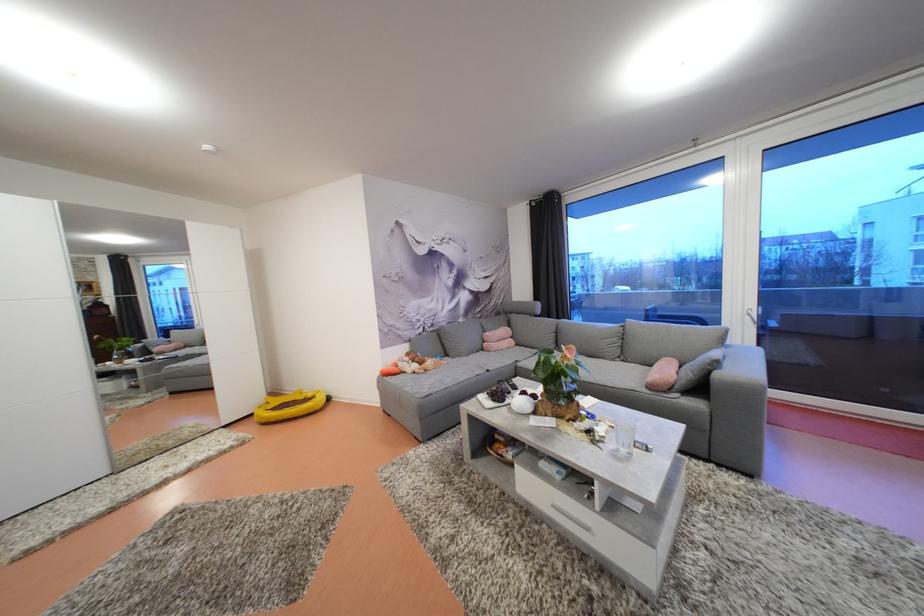
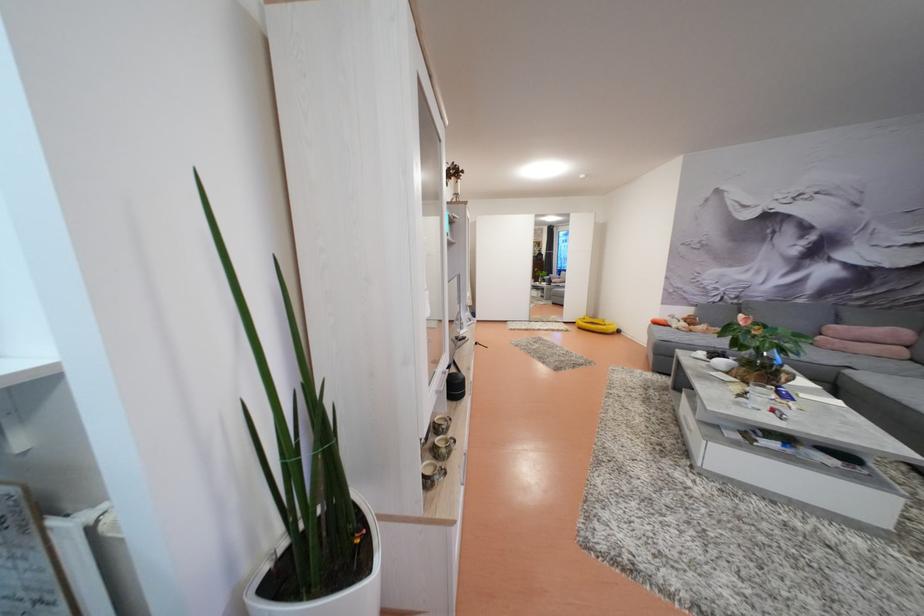
Where in the second image is the point corresponding to the point at 421,371 from the first image?

(689, 330)